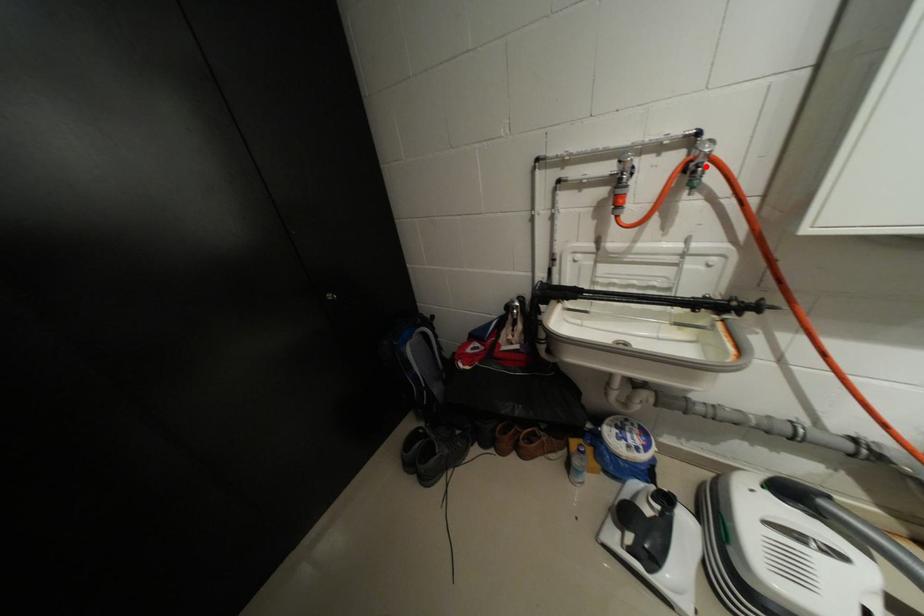
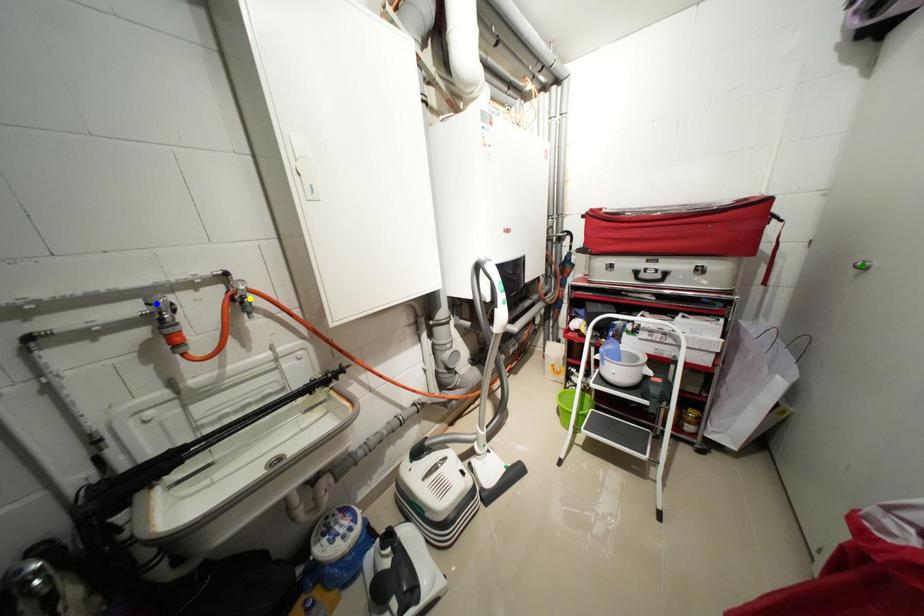
Question: I am providing you with two images of the same scene from different viewpoints. A red point is marked on the first image. You are given multiple points on the second image. Can you choose the point in image 2 that corresponds to the point in image 1?

Choices:
 (A) yellow point
 (B) green point
 (C) blue point

Answer: (A)